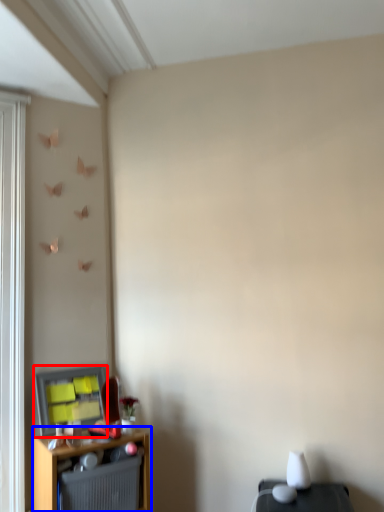
Question: Which object appears farthest to the camera in this image, window screen (highlighted by a red box) or shelf (highlighted by a blue box)?

Choices:
 (A) window screen
 (B) shelf

Answer: (A)